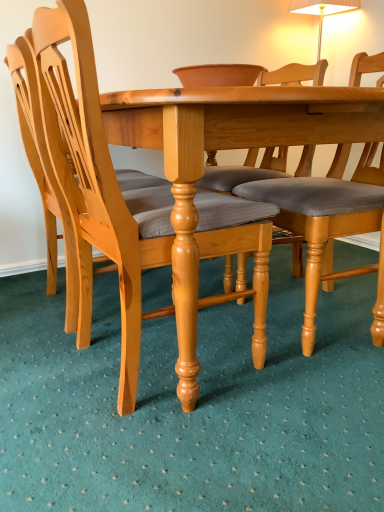
You are a GUI agent. You are given a task and a screenshot of the screen. Output one action in this format:
    pyautogui.click(x=<x>, y=<y>)
    Task: Click on the light wood chair at left, the third chair when ordered from right to left
    This screenshot has width=384, height=512.
    Given the screenshot: What is the action you would take?
    pyautogui.click(x=47, y=182)

In the scene shown: What is the approximate width of light brown wood chair at center, the 1th chair viewed from the right?

The width of light brown wood chair at center, the 1th chair viewed from the right, is 23.31 inches.

Locate an element on the screen. The width and height of the screenshot is (384, 512). light brown wood chair at left, acting as the second chair starting from the left is located at coordinates (98, 188).

Is light brown wood chair at left, placed as the second chair when sorted from right to left, taller or shorter than light wood chair at left, the third chair when ordered from right to left?

In the image, light brown wood chair at left, placed as the second chair when sorted from right to left, appears to be taller than light wood chair at left, the third chair when ordered from right to left.

From a real-world perspective, is light brown wood chair at left, placed as the second chair when sorted from right to left, under light wood chair at left, the third chair when ordered from right to left?

Yes, from a real-world perspective, light brown wood chair at left, placed as the second chair when sorted from right to left, is below light wood chair at left, the third chair when ordered from right to left.

Does light brown wood chair at left, placed as the second chair when sorted from right to left, appear on the right side of light wood chair at left, which is counted as the 1th chair, starting from the left?

Yes, light brown wood chair at left, placed as the second chair when sorted from right to left, is to the right of light wood chair at left, which is counted as the 1th chair, starting from the left.

Which object is further away from the camera taking this photo, light brown wood chair at left, placed as the second chair when sorted from right to left, or light wood chair at left, the third chair when ordered from right to left?

light wood chair at left, the third chair when ordered from right to left, is further away from the camera.

Which is behind, light wood chair at left, the third chair when ordered from right to left, or light brown wood chair at left, placed as the second chair when sorted from right to left?

light wood chair at left, the third chair when ordered from right to left, is further from the camera.

Which of these two, light wood chair at left, which is counted as the 1th chair, starting from the left, or light brown wood chair at left, placed as the second chair when sorted from right to left, stands shorter?

With less height is light wood chair at left, which is counted as the 1th chair, starting from the left.

Based on the photo, is light wood chair at left, which is counted as the 1th chair, starting from the left, positioned far away from light brown wood chair at left, acting as the second chair starting from the left?

They are positioned close to each other.

Is light wood chair at left, which is counted as the 1th chair, starting from the left, looking in the opposite direction of light brown wood chair at left, acting as the second chair starting from the left?

No, light wood chair at left, which is counted as the 1th chair, starting from the left, is not facing away from light brown wood chair at left, acting as the second chair starting from the left.

Can light brown wood chair at left, placed as the second chair when sorted from right to left, be found inside light brown wood chair at center, the 3th chair when ordered from left to right?

No, light brown wood chair at center, the 3th chair when ordered from left to right, does not contain light brown wood chair at left, placed as the second chair when sorted from right to left.

Is light brown wood chair at center, the 3th chair when ordered from left to right, touching light brown wood chair at left, placed as the second chair when sorted from right to left?

They are not placed beside each other.

Based on the photo, is light brown wood chair at center, the 1th chair viewed from the right, positioned with its back to light brown wood chair at left, acting as the second chair starting from the left?

No, light brown wood chair at center, the 1th chair viewed from the right, is not facing away from light brown wood chair at left, acting as the second chair starting from the left.

Between light brown wood chair at center, the 3th chair when ordered from left to right, and light brown wood chair at left, placed as the second chair when sorted from right to left, which one is positioned behind?

Positioned behind is light brown wood chair at center, the 3th chair when ordered from left to right.

How many degrees apart are the facing directions of light brown wood chair at center, the 1th chair viewed from the right, and light wood chair at left, which is counted as the 1th chair, starting from the left?

The angle between the facing direction of light brown wood chair at center, the 1th chair viewed from the right, and the facing direction of light wood chair at left, which is counted as the 1th chair, starting from the left, is 180 degrees.

From a real-world perspective, which is physically below, light brown wood chair at center, the 3th chair when ordered from left to right, or light wood chair at left, which is counted as the 1th chair, starting from the left?

light brown wood chair at center, the 3th chair when ordered from left to right.

Is light brown wood chair at center, the 3th chair when ordered from left to right, oriented towards light wood chair at left, the third chair when ordered from right to left?

No, light brown wood chair at center, the 3th chair when ordered from left to right, is not aimed at light wood chair at left, the third chair when ordered from right to left.

Between light brown wood chair at center, the 3th chair when ordered from left to right, and light wood chair at left, the third chair when ordered from right to left, which one has larger width?

light brown wood chair at center, the 3th chair when ordered from left to right, is wider.

Could you measure the distance between light wood chair at left, which is counted as the 1th chair, starting from the left, and light brown wood chair at center, the 1th chair viewed from the right?

light wood chair at left, which is counted as the 1th chair, starting from the left, and light brown wood chair at center, the 1th chair viewed from the right, are 27.09 inches apart from each other.

Is light wood chair at left, the third chair when ordered from right to left, facing towards light brown wood chair at center, the 3th chair when ordered from left to right?

No.

Would you consider light wood chair at left, the third chair when ordered from right to left, to be distant from light brown wood chair at center, the 1th chair viewed from the right?

light wood chair at left, the third chair when ordered from right to left, is actually quite close to light brown wood chair at center, the 1th chair viewed from the right.

Which point is more distant from viewer, (63, 218) or (288, 205)?

The point (63, 218) is farther from the camera.

Looking at this image, who is smaller, light brown wood chair at left, placed as the second chair when sorted from right to left, or light brown wood chair at center, the 1th chair viewed from the right?

light brown wood chair at center, the 1th chair viewed from the right, is smaller.

From the image's perspective, is light brown wood chair at left, acting as the second chair starting from the left, located above light brown wood chair at center, the 3th chair when ordered from left to right?

Actually, light brown wood chair at left, acting as the second chair starting from the left, appears below light brown wood chair at center, the 3th chair when ordered from left to right, in the image.

Which object is wider, light brown wood chair at left, acting as the second chair starting from the left, or light brown wood chair at center, the 1th chair viewed from the right?

Wider between the two is light brown wood chair at center, the 1th chair viewed from the right.

Where is `chair that is the 2nd one below the light wood chair at left, the third chair when ordered from right to left (from a real-world perspective)`? The height and width of the screenshot is (512, 384). chair that is the 2nd one below the light wood chair at left, the third chair when ordered from right to left (from a real-world perspective) is located at coordinates (98, 188).

From the image's perspective, count 2nd chairs upward from the light brown wood chair at left, acting as the second chair starting from the left, and point to it. Please provide its 2D coordinates.

[(47, 182)]

Considering their positions, is light brown wood chair at center, the 1th chair viewed from the right, positioned closer to light wood chair at left, which is counted as the 1th chair, starting from the left, than light brown wood chair at left, acting as the second chair starting from the left?

Based on the image, light brown wood chair at left, acting as the second chair starting from the left, appears to be nearer to light wood chair at left, which is counted as the 1th chair, starting from the left.

Estimate the real-world distances between objects in this image. Which object is closer to light wood chair at left, which is counted as the 1th chair, starting from the left, light brown wood chair at left, acting as the second chair starting from the left, or light brown wood chair at center, the 1th chair viewed from the right?

light brown wood chair at left, acting as the second chair starting from the left, lies closer to light wood chair at left, which is counted as the 1th chair, starting from the left, than the other object.

From the image, which object appears to be farther from light brown wood chair at left, placed as the second chair when sorted from right to left, light brown wood chair at center, the 3th chair when ordered from left to right, or light wood chair at left, the third chair when ordered from right to left?

Based on the image, light brown wood chair at center, the 3th chair when ordered from left to right, appears to be further to light brown wood chair at left, placed as the second chair when sorted from right to left.

Which object lies further to the anchor point light brown wood chair at left, acting as the second chair starting from the left, light wood chair at left, the third chair when ordered from right to left, or light brown wood chair at center, the 1th chair viewed from the right?

light brown wood chair at center, the 1th chair viewed from the right, lies further to light brown wood chair at left, acting as the second chair starting from the left, than the other object.

When comparing their distances from light brown wood chair at center, the 1th chair viewed from the right, does light wood chair at left, the third chair when ordered from right to left, or light brown wood chair at left, acting as the second chair starting from the left, seem further?

light wood chair at left, the third chair when ordered from right to left, lies further to light brown wood chair at center, the 1th chair viewed from the right, than the other object.

In the scene shown: Considering their positions, is light brown wood chair at left, placed as the second chair when sorted from right to left, positioned closer to light brown wood chair at center, the 1th chair viewed from the right, than light wood chair at left, the third chair when ordered from right to left?

Among the two, light brown wood chair at left, placed as the second chair when sorted from right to left, is located nearer to light brown wood chair at center, the 1th chair viewed from the right.

Identify the location of chair between light wood chair at left, the third chair when ordered from right to left, and light brown wood chair at center, the 3th chair when ordered from left to right, from left to right. (98, 188).